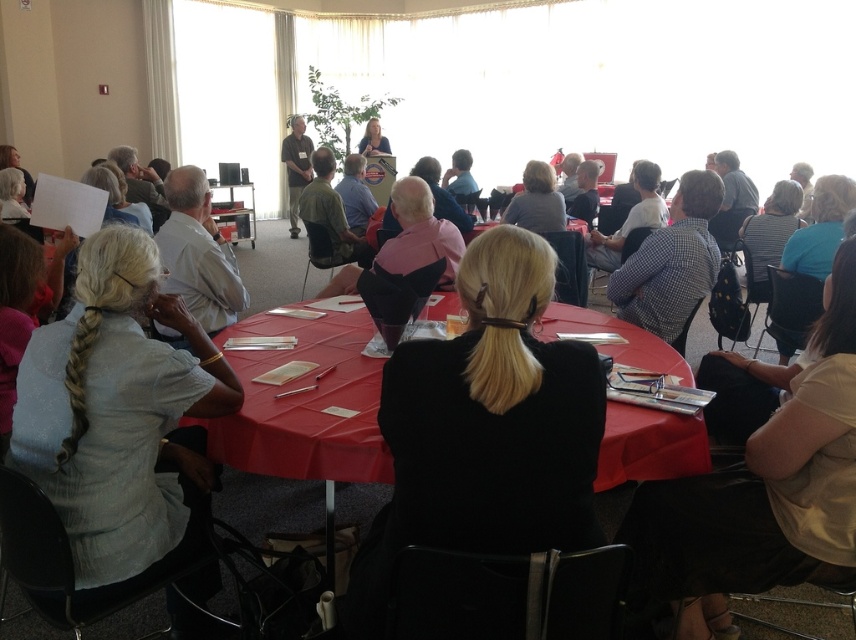
Question: In this image, where is blue checkered shirt at center located relative to matte black laptop at center?

Choices:
 (A) below
 (B) above

Answer: (A)

Question: Among these objects, which one is nearest to the camera?

Choices:
 (A) matte brown shirt at center
 (B) black fabric coat at center
 (C) matte black laptop at center
 (D) light brown hair at center

Answer: (B)

Question: Which point appears farthest from the camera in this image?

Choices:
 (A) (531, 202)
 (B) (328, 403)
 (C) (299, 189)

Answer: (C)

Question: Estimate the real-world distances between objects in this image. Which object is farther from the red cloth table at center?

Choices:
 (A) blue checkered shirt at center
 (B) light brown hair at center
 (C) black fabric coat at center
 (D) light blue fabric shirt at lower left

Answer: (B)

Question: Does matte white shirt at center lie behind light brown hair at center?

Choices:
 (A) no
 (B) yes

Answer: (A)

Question: Does light blue fabric shirt at lower left lie behind matte white shirt at center?

Choices:
 (A) yes
 (B) no

Answer: (B)